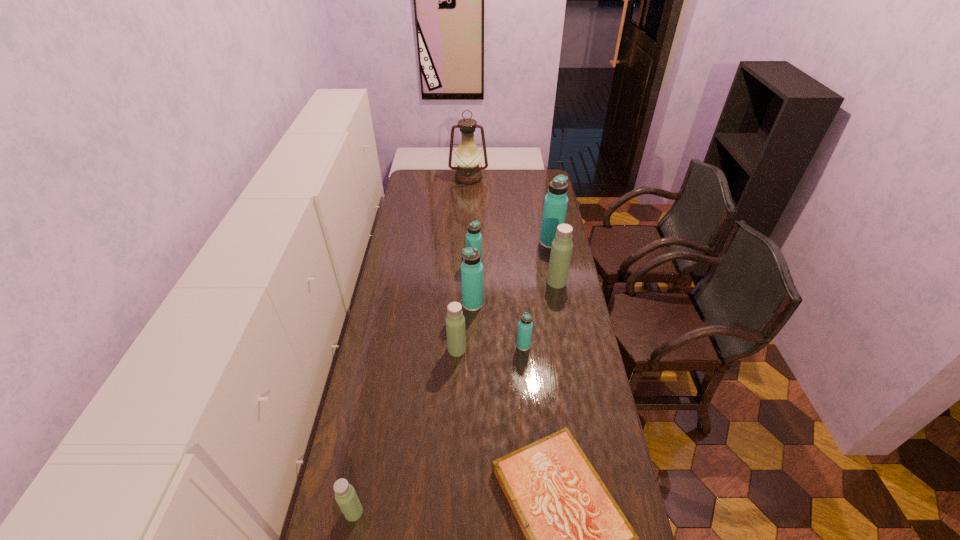
Image resolution: width=960 pixels, height=540 pixels. What are the coordinates of `free location located on the front of the second nearest light thermos bottle` in the screenshot? It's located at (453, 420).

You are a GUI agent. You are given a task and a screenshot of the screen. Output one action in this format:
    pyautogui.click(x=<x>, y=<y>)
    Task: Click on the free region located 0.180m on the back of the smallest aqua thermos bottle
    Image resolution: width=960 pixels, height=540 pixels.
    Given the screenshot: What is the action you would take?
    pyautogui.click(x=520, y=307)

You are a GUI agent. You are given a task and a screenshot of the screen. Output one action in this format:
    pyautogui.click(x=<x>, y=<y>)
    Task: Click on the vacant region located on the back of the leftmost object
    The image size is (960, 540).
    Given the screenshot: What is the action you would take?
    pyautogui.click(x=372, y=418)

At what (x,y) coordinates should I click in order to perform the action: click on object situated at the far edge. Please return your answer as a coordinate pair (x, y). Looking at the image, I should click on (467, 155).

The height and width of the screenshot is (540, 960). In order to click on object that is at the left edge in this screenshot , I will do `click(345, 495)`.

This screenshot has width=960, height=540. In the image, there is a desktop. In order to click on vacant space at the far edge in this screenshot , I will do `click(461, 186)`.

Identify the location of free space at the left edge. (371, 337).

Locate an element on the screen. The height and width of the screenshot is (540, 960). vacant space at the right edge is located at coordinates [537, 246].

Image resolution: width=960 pixels, height=540 pixels. I want to click on free space at the far left corner, so pyautogui.click(x=426, y=180).

The height and width of the screenshot is (540, 960). I want to click on vacant area between the nearest aqua thermos bottle and the third farthest object, so click(499, 306).